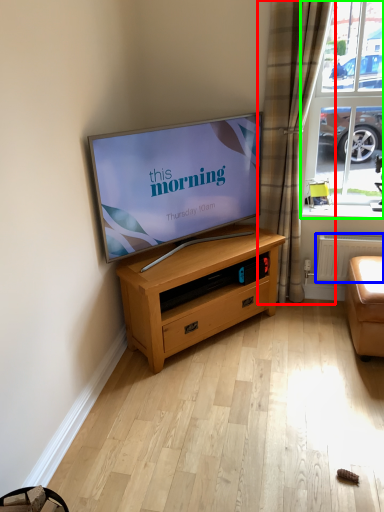
Question: Estimate the real-world distances between objects in this image. Which object is farther from curtain (highlighted by a red box), radiator (highlighted by a blue box) or window (highlighted by a green box)?

Choices:
 (A) radiator
 (B) window

Answer: (A)